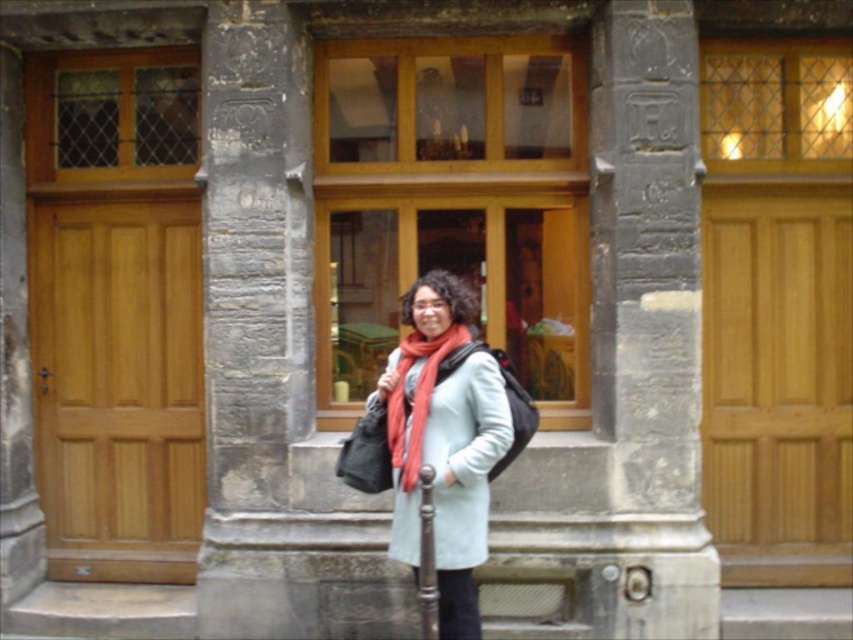
Who is more distant from viewer, (469,416) or (416,461)?

The point (469,416) is behind.

Between matte blue coat at center and matte red scarf at center, which one appears on the left side from the viewer's perspective?

matte red scarf at center

Describe the element at coordinates (444, 442) in the screenshot. I see `matte blue coat at center` at that location.

The width and height of the screenshot is (853, 640). In order to click on matte blue coat at center in this screenshot , I will do `click(444, 442)`.

Is point (86, 458) less distant than point (407, 480)?

No, it is not.

Who is positioned more to the right, light brown wood door at left or matte red scarf at center?

From the viewer's perspective, matte red scarf at center appears more on the right side.

Is point (109, 444) closer to viewer compared to point (454, 340)?

No, (109, 444) is further to viewer.

You are a GUI agent. You are given a task and a screenshot of the screen. Output one action in this format:
    pyautogui.click(x=<x>, y=<y>)
    Task: Click on the light brown wood door at left
    
    Given the screenshot: What is the action you would take?
    pyautogui.click(x=119, y=385)

Between gray stone pillar at center and matte blue coat at center, which one appears on the right side from the viewer's perspective?

From the viewer's perspective, gray stone pillar at center appears more on the right side.

Who is more forward, (688, 342) or (422, 378)?

Positioned in front is point (422, 378).

What are the coordinates of `gray stone pillar at center` in the screenshot? It's located at (648, 320).